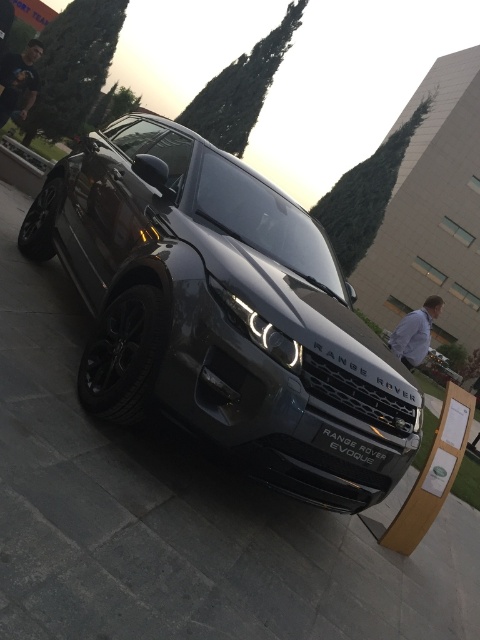
This screenshot has height=640, width=480. What do you see at coordinates (219, 308) in the screenshot? I see `satin metallic range rover evoque at center` at bounding box center [219, 308].

Is satin metallic range rover evoque at center smaller than satin black range rover evoque at center?

No, satin metallic range rover evoque at center is not smaller than satin black range rover evoque at center.

Is point (164, 180) more distant than point (418, 321)?

No, it is not.

Locate an element on the screen. satin metallic range rover evoque at center is located at coordinates (219, 308).

Is satin metallic range rover evoque at center positioned at the back of black matte range rover evoque at center?

No, satin metallic range rover evoque at center is in front of black matte range rover evoque at center.

At what (x,y) coordinates should I click in order to perform the action: click on satin metallic range rover evoque at center. Please return your answer as a coordinate pair (x, y). Looking at the image, I should click on point(219,308).

Is point (424, 349) positioned before point (344, 440)?

No.

Does satin black range rover evoque at center appear under black matte range rover evoque at center?

No.

Is point (430, 298) positioned in front of point (384, 465)?

No, (430, 298) is behind (384, 465).

The height and width of the screenshot is (640, 480). Find the location of `satin black range rover evoque at center`. satin black range rover evoque at center is located at coordinates (415, 332).